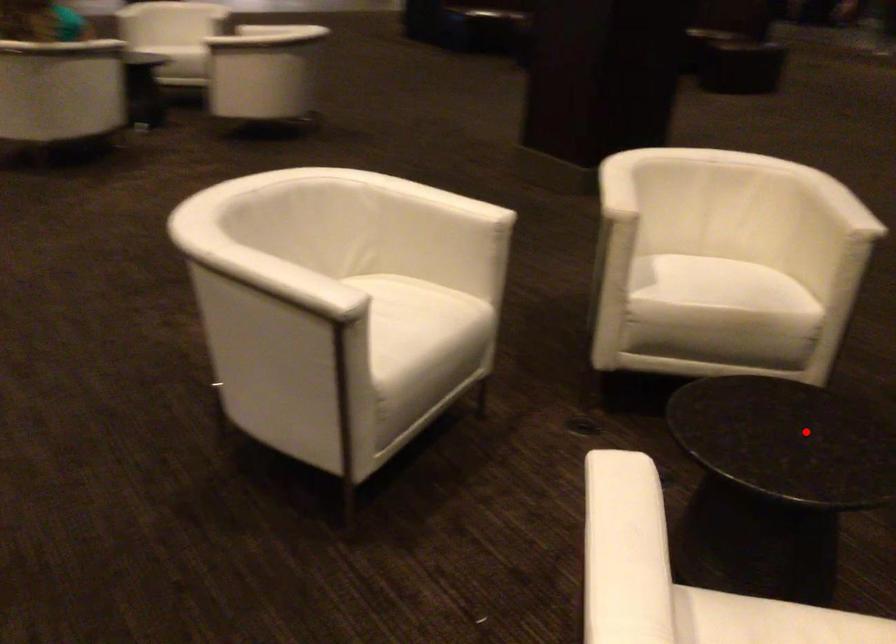
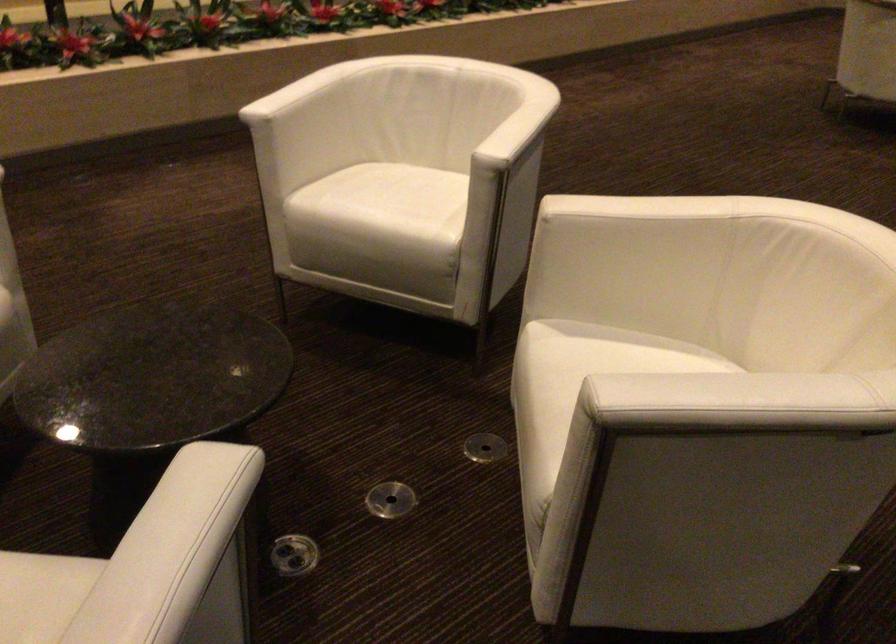
Question: I am providing you with two images of the same scene from different viewpoints. In image1, a red point is highlighted. Considering the same 3D point in image2, which of the following is correct?

Choices:
 (A) It is closer
 (B) It is farther

Answer: (A)